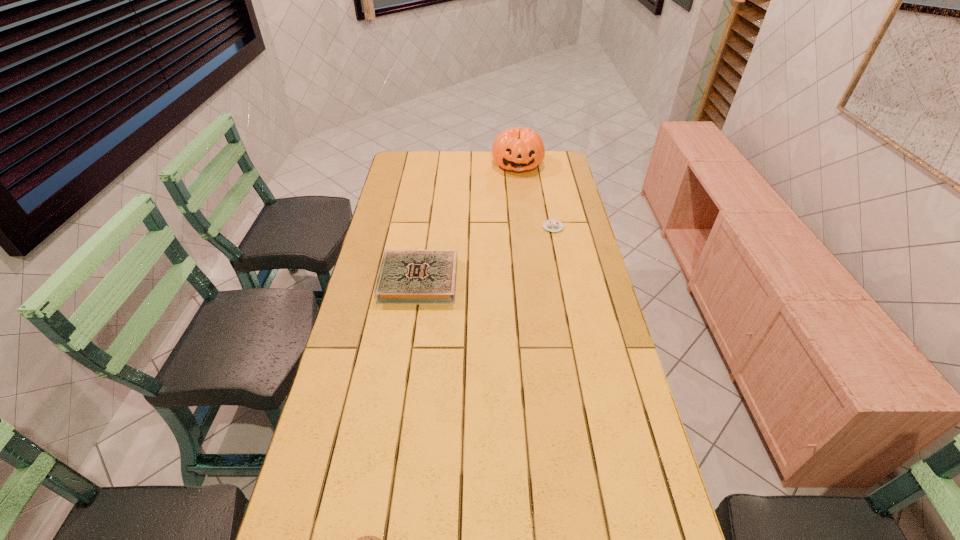
Where is `pumpkin present at the right edge`? The image size is (960, 540). pumpkin present at the right edge is located at coordinates (517, 149).

You are a GUI agent. You are given a task and a screenshot of the screen. Output one action in this format:
    pyautogui.click(x=<x>, y=<y>)
    Task: Click on the cupcake at the right edge
    The width and height of the screenshot is (960, 540).
    Given the screenshot: What is the action you would take?
    pyautogui.click(x=551, y=225)

Locate an element on the screen. This screenshot has height=540, width=960. object that is positioned at the far right corner is located at coordinates (517, 149).

Locate an element on the screen. The image size is (960, 540). vacant area at the left edge of the desktop is located at coordinates (420, 198).

At what (x,y) coordinates should I click in order to perform the action: click on vacant space at the right edge of the desktop. Please return your answer as a coordinate pair (x, y). The image size is (960, 540). Looking at the image, I should click on (549, 177).

Image resolution: width=960 pixels, height=540 pixels. I want to click on free space between the second tallest object and the cupcake, so 486,254.

Find the location of a particular element. This screenshot has height=540, width=960. empty location between the hardback book and the cupcake is located at coordinates (486, 254).

Where is `free spot between the second nearest object and the farthest object`? This screenshot has height=540, width=960. free spot between the second nearest object and the farthest object is located at coordinates (468, 222).

The height and width of the screenshot is (540, 960). Find the location of `empty space between the cupcake and the hardback book`. empty space between the cupcake and the hardback book is located at coordinates (486, 254).

Identify which object is the second nearest to the hardback book. Please provide its 2D coordinates. Your answer should be formatted as a tuple, i.e. [(x, y)], where the tuple contains the x and y coordinates of a point satisfying the conditions above.

[(517, 149)]